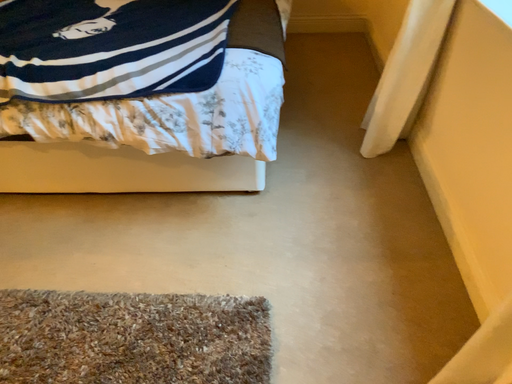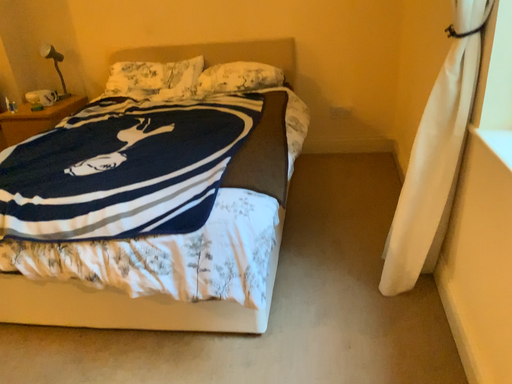
Question: Which way did the camera rotate in the video?

Choices:
 (A) rotated left
 (B) rotated right

Answer: (A)